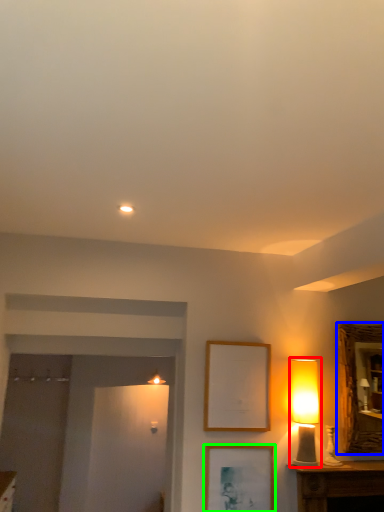
Question: Which is farther away from table lamp (highlighted by a red box)? mirror (highlighted by a blue box) or picture frame (highlighted by a green box)?

Choices:
 (A) mirror
 (B) picture frame

Answer: (B)